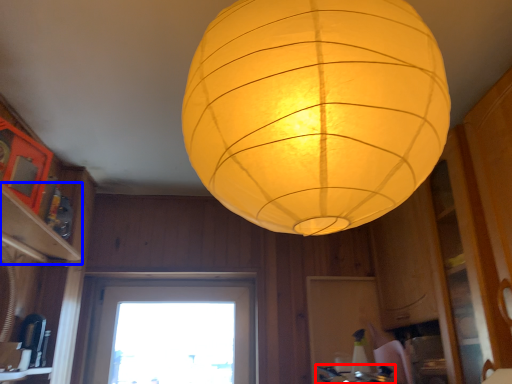
Question: Which object appears closest to the camera in this image, gas stove (highlighted by a red box) or shelf (highlighted by a blue box)?

Choices:
 (A) gas stove
 (B) shelf

Answer: (B)